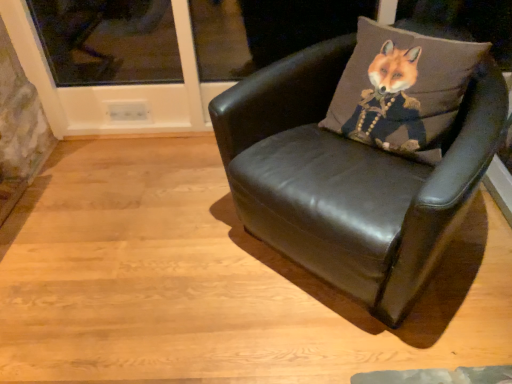
Question: Is there a large distance between brown fabric fox at upper right and black leather chair at center?

Choices:
 (A) yes
 (B) no

Answer: (B)

Question: Would you say brown fabric fox at upper right is outside black leather chair at center?

Choices:
 (A) yes
 (B) no

Answer: (B)

Question: From a real-world perspective, is brown fabric fox at upper right under black leather chair at center?

Choices:
 (A) no
 (B) yes

Answer: (A)

Question: From the image's perspective, is brown fabric fox at upper right above black leather chair at center?

Choices:
 (A) no
 (B) yes

Answer: (B)

Question: Can you confirm if brown fabric fox at upper right is smaller than black leather chair at center?

Choices:
 (A) no
 (B) yes

Answer: (B)

Question: Can you confirm if brown fabric fox at upper right is positioned to the right of black leather chair at center?

Choices:
 (A) no
 (B) yes

Answer: (B)

Question: Is black leather chair at center smaller than brown fabric fox at upper right?

Choices:
 (A) no
 (B) yes

Answer: (A)

Question: Can you confirm if black leather chair at center is bigger than brown fabric fox at upper right?

Choices:
 (A) no
 (B) yes

Answer: (B)

Question: Is black leather chair at center to the right of brown fabric fox at upper right from the viewer's perspective?

Choices:
 (A) no
 (B) yes

Answer: (A)

Question: Does black leather chair at center turn towards brown fabric fox at upper right?

Choices:
 (A) yes
 (B) no

Answer: (B)

Question: From the image's perspective, is black leather chair at center under brown fabric fox at upper right?

Choices:
 (A) no
 (B) yes

Answer: (B)

Question: Is black leather chair at center further to camera compared to brown fabric fox at upper right?

Choices:
 (A) yes
 (B) no

Answer: (B)

Question: In terms of height, does brown fabric fox at upper right look taller or shorter compared to black leather chair at center?

Choices:
 (A) tall
 (B) short

Answer: (B)